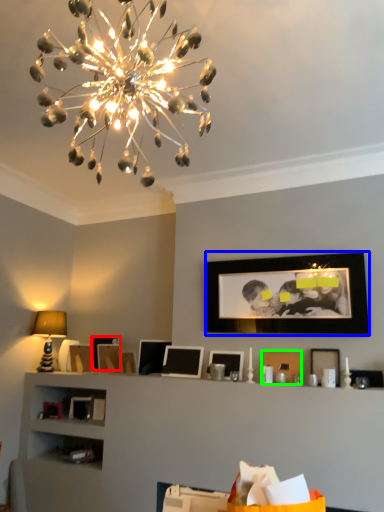
Question: Which object is positioned farthest from picture frame (highlighted by a red box)? Select from picture frame (highlighted by a blue box) and picture frame (highlighted by a green box).

Choices:
 (A) picture frame
 (B) picture frame

Answer: (A)